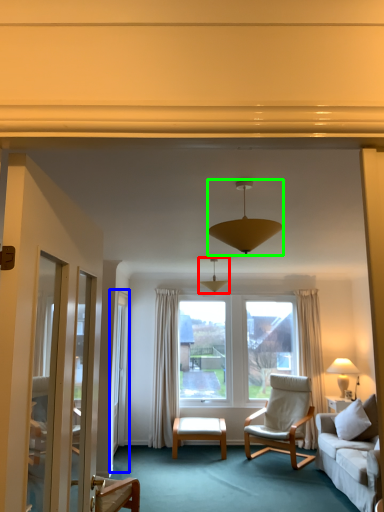
Question: Which is farther away from lamp (highlighted by a red box)? screen door (highlighted by a blue box) or lamp (highlighted by a green box)?

Choices:
 (A) screen door
 (B) lamp

Answer: (B)